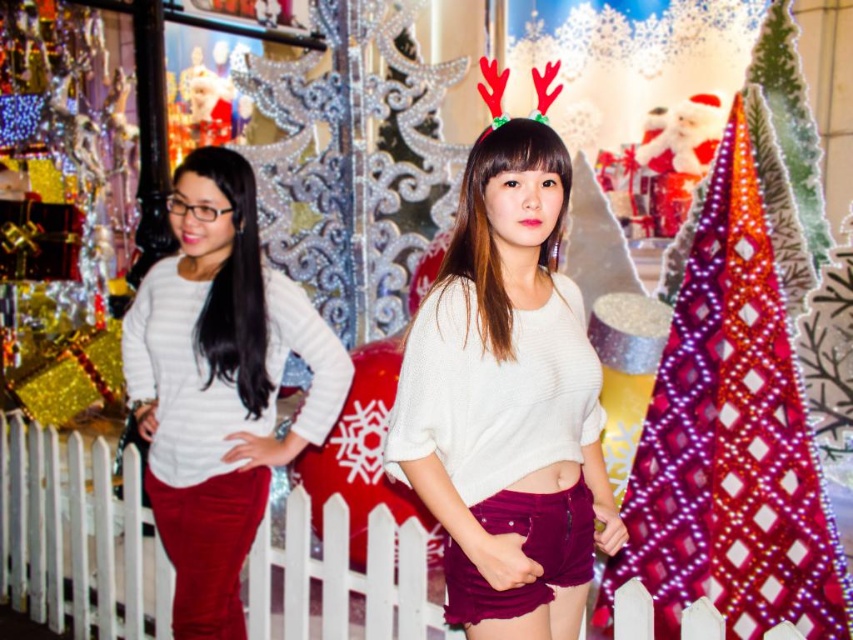
Which is in front, point (532, 552) or point (744, 445)?

Point (532, 552) is more forward.

Is velvet burgundy shorts at center to the right of shiny metallic christmas tree at right from the viewer's perspective?

No, velvet burgundy shorts at center is not to the right of shiny metallic christmas tree at right.

Is point (526, 525) positioned after point (791, 568)?

No, (526, 525) is closer to viewer.

The image size is (853, 640). In order to click on velvet burgundy shorts at center in this screenshot , I will do `click(508, 401)`.

Is velvet burgundy shorts at center to the right of white matte sweater at center from the viewer's perspective?

Indeed, velvet burgundy shorts at center is positioned on the right side of white matte sweater at center.

Does velvet burgundy shorts at center have a greater width compared to white matte sweater at center?

In fact, velvet burgundy shorts at center might be narrower than white matte sweater at center.

The height and width of the screenshot is (640, 853). What do you see at coordinates (508, 401) in the screenshot?
I see `velvet burgundy shorts at center` at bounding box center [508, 401].

Where is `velvet burgundy shorts at center`? The height and width of the screenshot is (640, 853). velvet burgundy shorts at center is located at coordinates (508, 401).

Between shiny metallic christmas tree at right and white matte sweater at center, which one appears on the right side from the viewer's perspective?

Positioned to the right is shiny metallic christmas tree at right.

Which is behind, point (660, 448) or point (141, 365)?

Point (141, 365)

Who is more forward, (848, 627) or (198, 344)?

Positioned in front is point (848, 627).

You are a GUI agent. You are given a task and a screenshot of the screen. Output one action in this format:
    pyautogui.click(x=<x>, y=<y>)
    Task: Click on the shiny metallic christmas tree at right
    
    Given the screenshot: What is the action you would take?
    pyautogui.click(x=730, y=438)